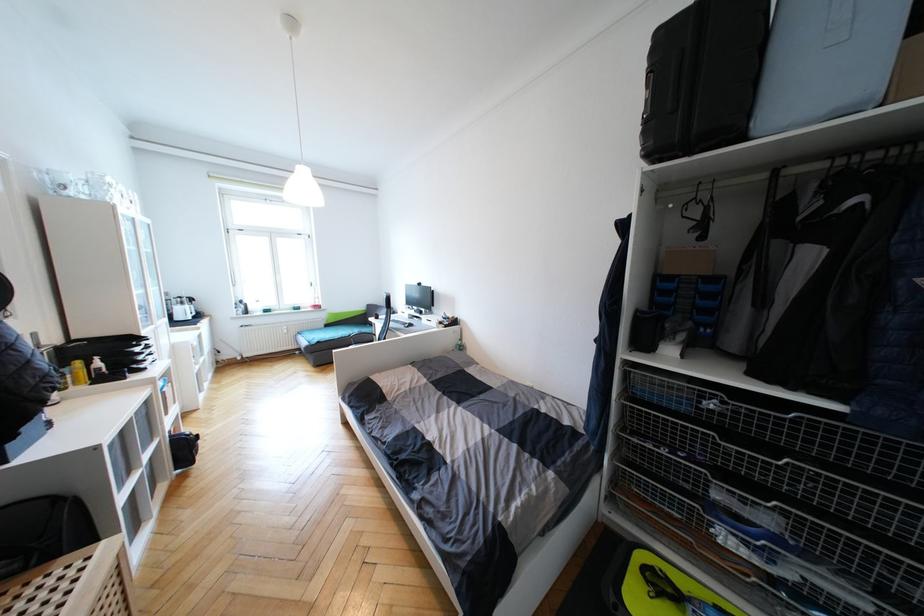
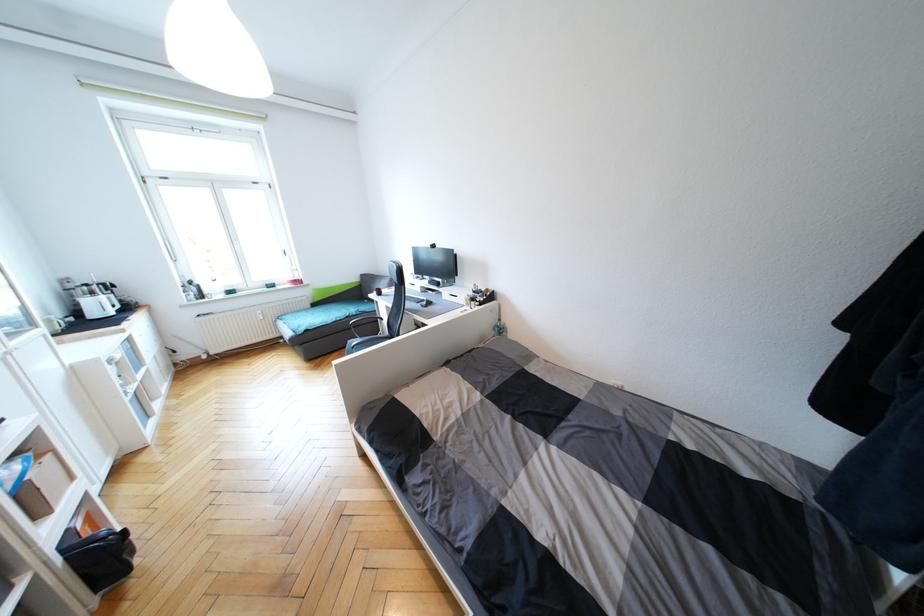
The point at (444, 323) is marked in the first image. Where is the corresponding point in the second image?

(476, 301)